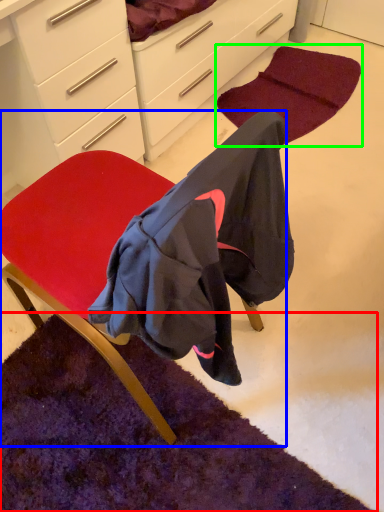
Question: Estimate the real-world distances between objects in this image. Which object is closer to mat (highlighted by a red box), chair (highlighted by a blue box) or mat (highlighted by a green box)?

Choices:
 (A) chair
 (B) mat

Answer: (A)